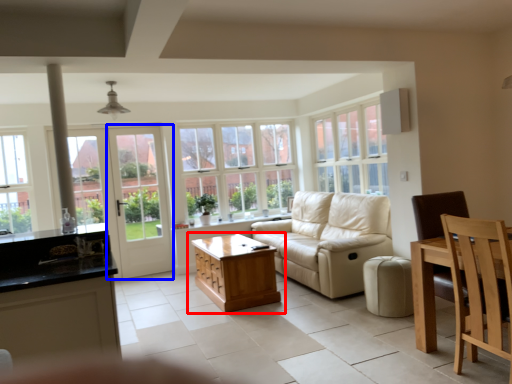
Question: Which of the following is the closest to the observer, table (highlighted by a red box) or screen door (highlighted by a blue box)?

Choices:
 (A) table
 (B) screen door

Answer: (A)